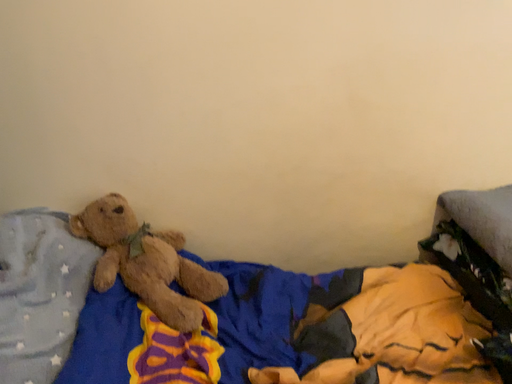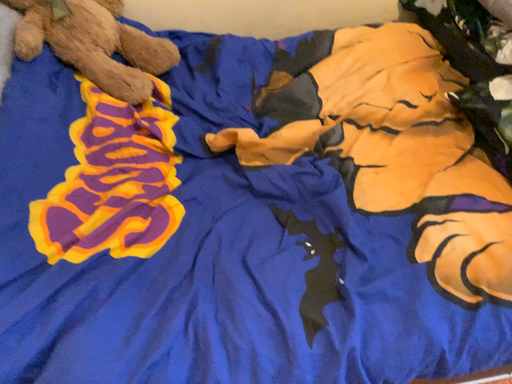
Question: How did the camera likely rotate when shooting the video?

Choices:
 (A) rotated upward
 (B) rotated downward

Answer: (B)